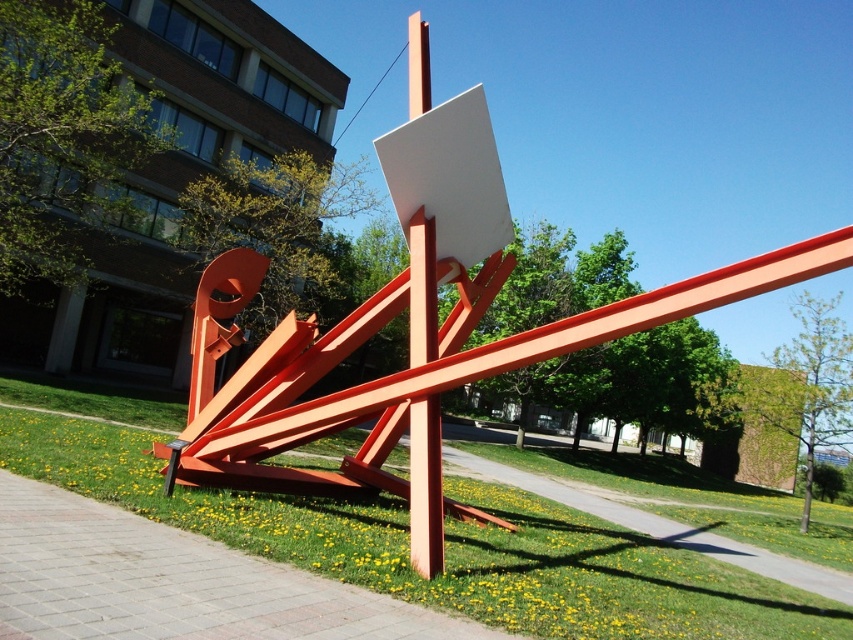
Question: Which object appears closest to the camera in this image?

Choices:
 (A) green grass at lower center
 (B) orange metallic sculpture at center
 (C) matte orange pole at center

Answer: (A)

Question: Observing the image, what is the correct spatial positioning of orange metallic sculpture at center in reference to matte orange pole at center?

Choices:
 (A) above
 (B) below

Answer: (B)

Question: Can you confirm if green grass at lower center is positioned to the left of matte orange pole at center?

Choices:
 (A) no
 (B) yes

Answer: (B)

Question: Among these objects, which one is farthest from the camera?

Choices:
 (A) orange metallic sculpture at center
 (B) green grass at lower center
 (C) matte orange pole at center

Answer: (A)

Question: Can you confirm if green grass at lower center is thinner than matte orange pole at center?

Choices:
 (A) yes
 (B) no

Answer: (B)

Question: Which point is closer to the camera?

Choices:
 (A) (264, 484)
 (B) (425, 461)
 (C) (556, 524)

Answer: (B)